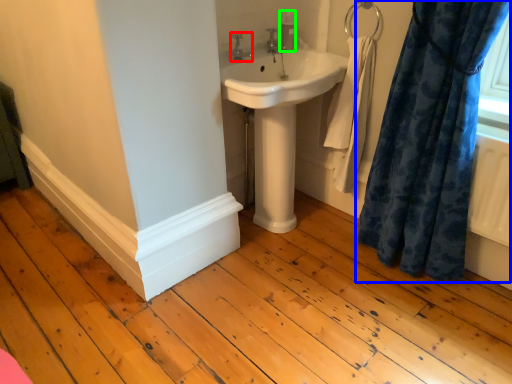
Question: Estimate the real-world distances between objects in this image. Which object is farther from tap (highlighted by a red box), curtain (highlighted by a blue box) or toiletry (highlighted by a green box)?

Choices:
 (A) curtain
 (B) toiletry

Answer: (A)